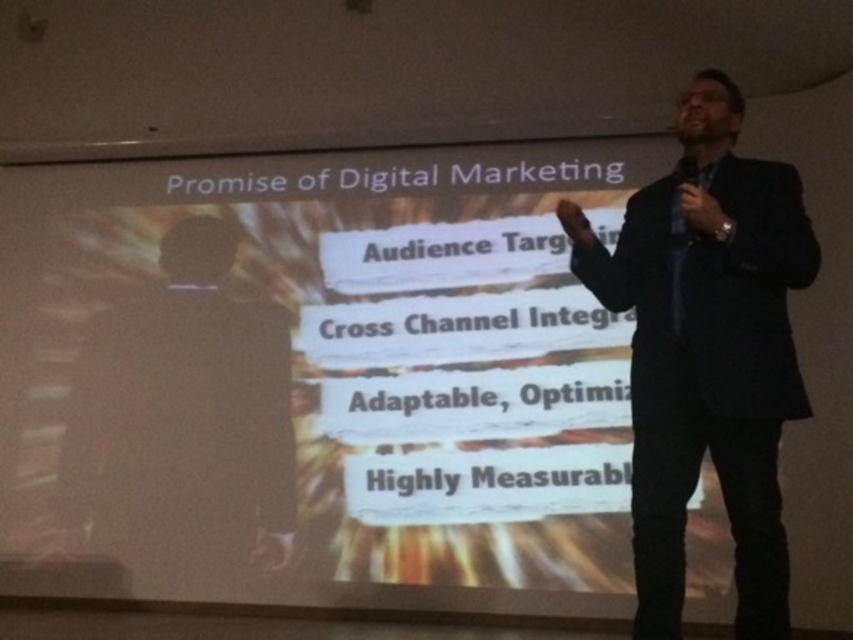
Question: Among these points, which one is farthest from the camera?

Choices:
 (A) (399, 589)
 (B) (659, 508)
 (C) (94, 328)

Answer: (C)

Question: Where is white matte projector screen at upper center located in relation to black suit at center in the image?

Choices:
 (A) below
 (B) above

Answer: (B)

Question: Which of the following is the farthest from the observer?

Choices:
 (A) white matte projector screen at upper center
 (B) black suit at center

Answer: (B)

Question: Which object is positioned farthest from the white matte projector screen at upper center?

Choices:
 (A) black suit at center
 (B) dark blue suit at center

Answer: (B)

Question: Does dark blue suit at center come in front of black suit at center?

Choices:
 (A) no
 (B) yes

Answer: (B)

Question: Is dark blue suit at center to the left of black suit at center from the viewer's perspective?

Choices:
 (A) yes
 (B) no

Answer: (B)